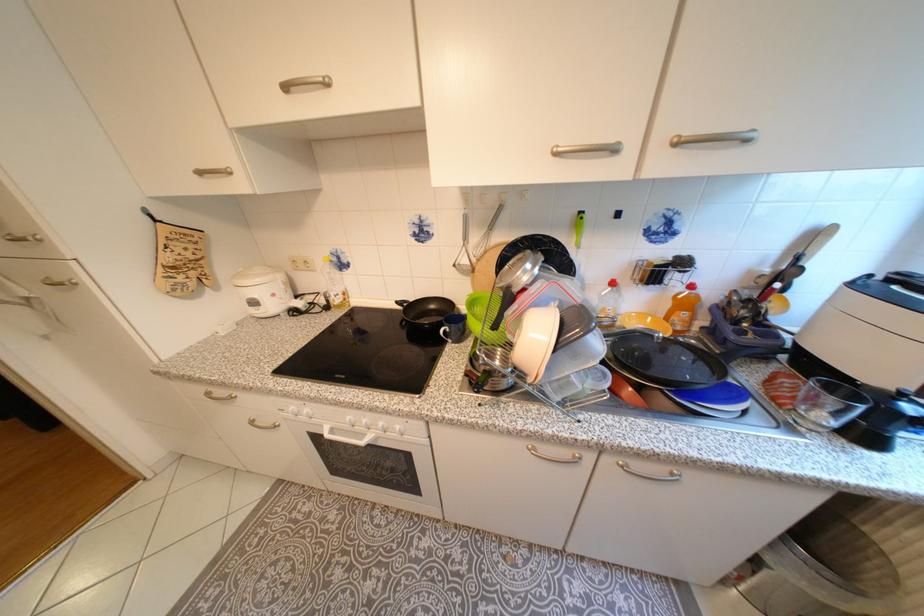
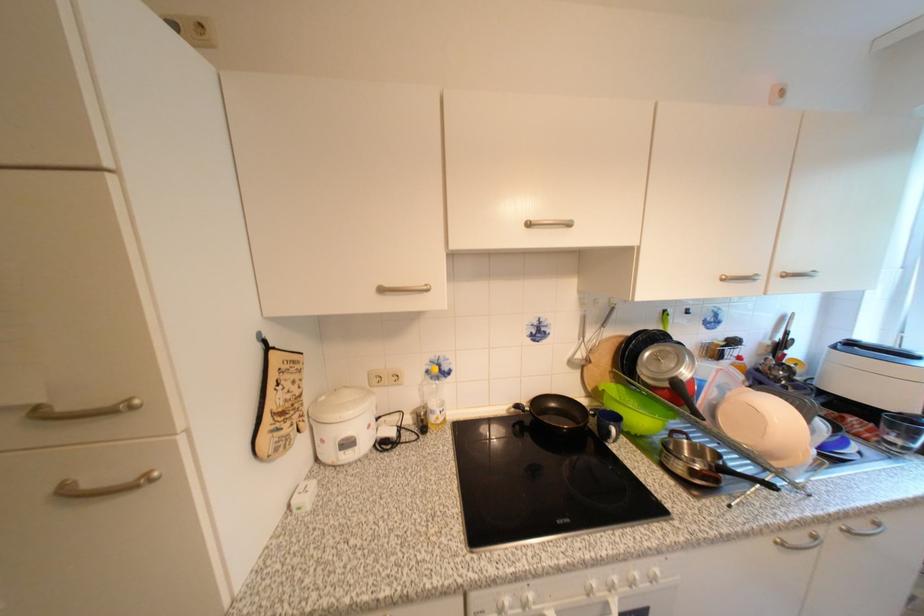
The point at (x=687, y=143) is marked in the first image. Where is the corresponding point in the second image?

(796, 277)